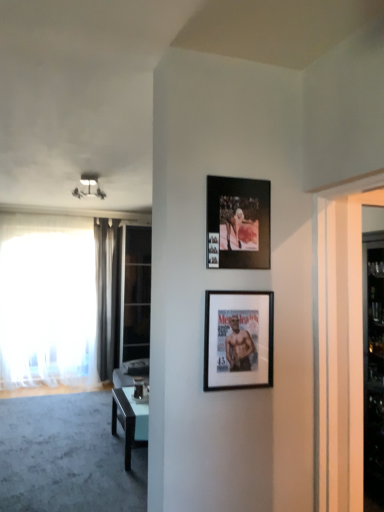
Question: From the image's perspective, is black matte picture frame at upper center, which appears as the 2th picture frame when ordered from the bottom, below transparent glass door at left?

Choices:
 (A) no
 (B) yes

Answer: (A)

Question: Is black matte picture frame at upper center, which appears as the 2th picture frame when ordered from the bottom, directly adjacent to transparent glass door at left?

Choices:
 (A) no
 (B) yes

Answer: (A)

Question: From the image's perspective, is black matte picture frame at upper center, which is the first picture frame in top-to-bottom order, above transparent glass door at left?

Choices:
 (A) yes
 (B) no

Answer: (A)

Question: Considering the relative sizes of black matte picture frame at upper center, which is the first picture frame in top-to-bottom order, and transparent glass door at left in the image provided, is black matte picture frame at upper center, which is the first picture frame in top-to-bottom order, shorter than transparent glass door at left?

Choices:
 (A) yes
 (B) no

Answer: (A)

Question: Does black matte picture frame at upper center, which appears as the 2th picture frame when ordered from the bottom, have a lesser width compared to transparent glass door at left?

Choices:
 (A) yes
 (B) no

Answer: (A)

Question: Based on their positions, is white glass door at right located to the left or right of matte white light fixture at upper left?

Choices:
 (A) left
 (B) right

Answer: (B)

Question: Considering their positions, is white glass door at right located in front of or behind matte white light fixture at upper left?

Choices:
 (A) behind
 (B) front

Answer: (B)

Question: Is point (344, 455) closer or farther from the camera than point (72, 190)?

Choices:
 (A) farther
 (B) closer

Answer: (B)

Question: Looking at the image, does white glass door at right seem bigger or smaller compared to matte white light fixture at upper left?

Choices:
 (A) small
 (B) big

Answer: (B)

Question: Is white glass door at right wider or thinner than black matte picture frame at upper center, which appears as the 2th picture frame when ordered from the bottom?

Choices:
 (A) thin
 (B) wide

Answer: (B)

Question: From a real-world perspective, relative to black matte picture frame at upper center, which appears as the 2th picture frame when ordered from the bottom, is white glass door at right vertically above or below?

Choices:
 (A) above
 (B) below

Answer: (B)

Question: Is white glass door at right in front of or behind black matte picture frame at upper center, which is the first picture frame in top-to-bottom order, in the image?

Choices:
 (A) front
 (B) behind

Answer: (A)

Question: Looking at the image, does white glass door at right seem bigger or smaller compared to black matte picture frame at upper center, which appears as the 2th picture frame when ordered from the bottom?

Choices:
 (A) big
 (B) small

Answer: (A)

Question: Does point (124, 238) appear closer or farther from the camera than point (223, 301)?

Choices:
 (A) closer
 (B) farther

Answer: (B)

Question: From a real-world perspective, relative to black matte picture frame at center, placed as the 1th picture frame when sorted from bottom to top, is transparent glass door at left vertically above or below?

Choices:
 (A) above
 (B) below

Answer: (B)